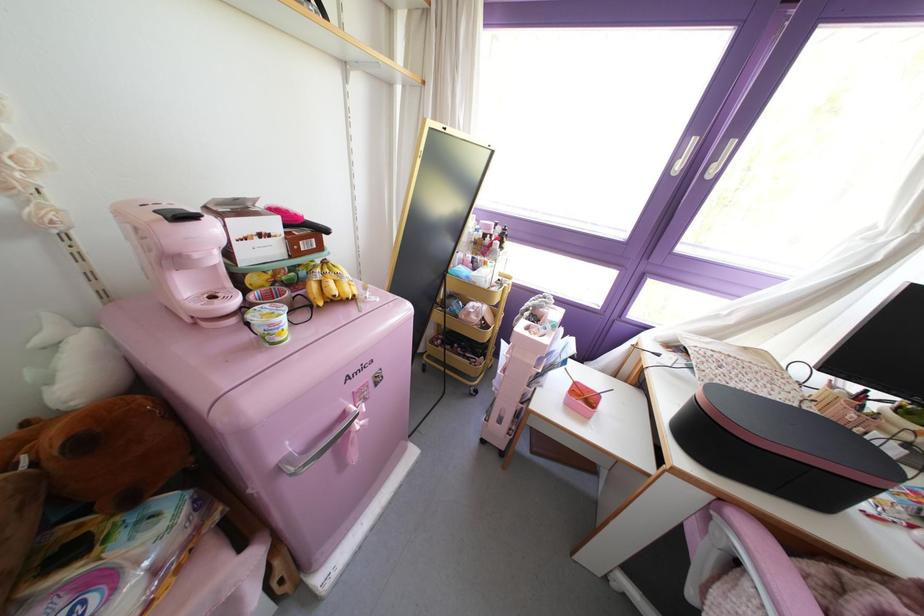
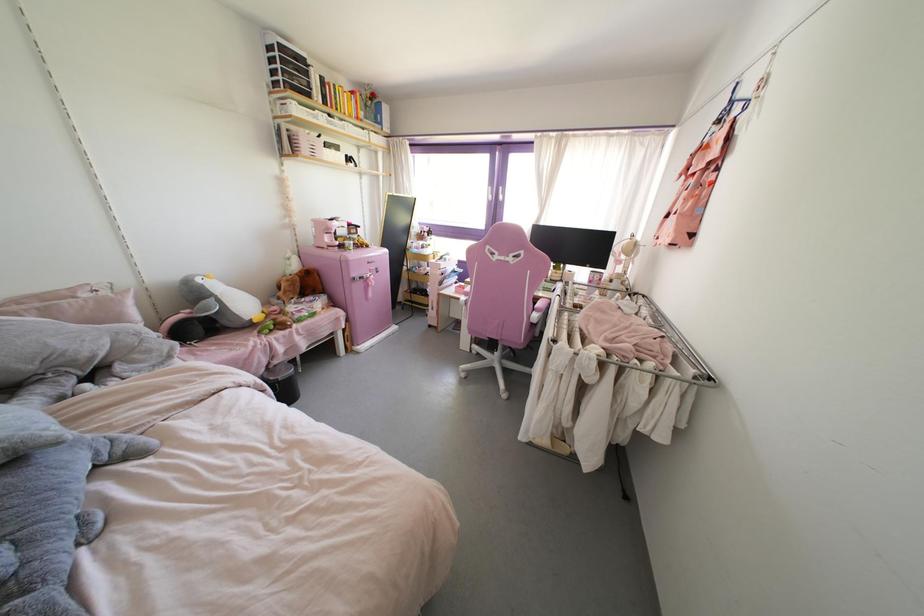
Question: The images are taken continuously from a first-person perspective. In which direction are you moving?

Choices:
 (A) Left
 (B) Right
 (C) Forward
 (D) Backward

Answer: (D)